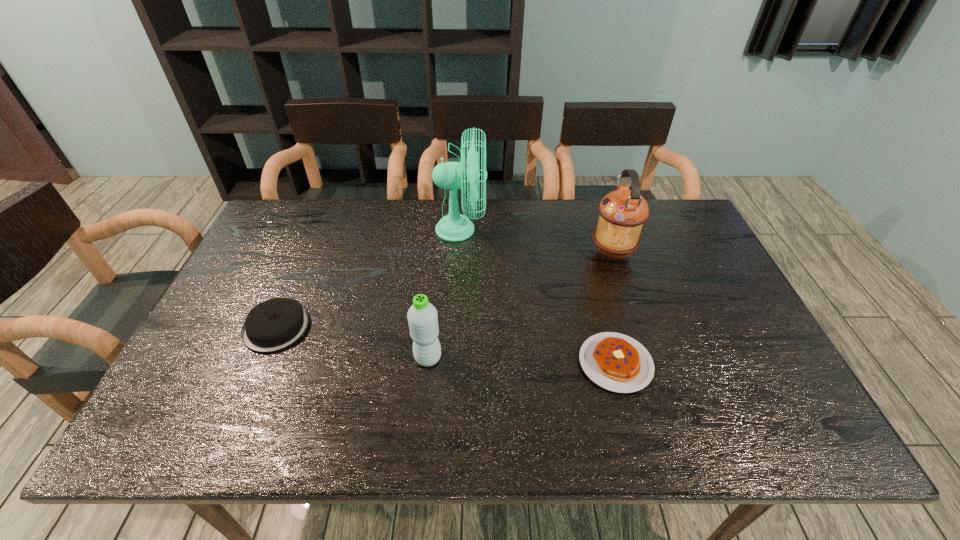
Locate an element on the screen. This screenshot has height=540, width=960. vacant area situated 0.130m on the back of the taller pancake is located at coordinates (300, 271).

Identify the location of vacant space located 0.110m on the left of the shortest object. (534, 363).

Find the location of `fan at the far edge`. fan at the far edge is located at coordinates (454, 227).

Locate an element on the screen. oil lamp at the far edge is located at coordinates (623, 212).

The width and height of the screenshot is (960, 540). Identify the location of object located at the left edge. (x=275, y=324).

At what (x,y) coordinates should I click in order to perform the action: click on free space at the far edge of the desktop. Please return your answer as a coordinate pair (x, y). Looking at the image, I should click on (380, 211).

Find the location of a particular element. Image resolution: width=960 pixels, height=540 pixels. free space at the near edge of the desktop is located at coordinates (569, 414).

The image size is (960, 540). I want to click on free region at the left edge, so click(279, 296).

The width and height of the screenshot is (960, 540). Identify the location of vacant space at the right edge of the desktop. (731, 314).

Where is `vacant space at the near left corner of the desktop`? vacant space at the near left corner of the desktop is located at coordinates (188, 430).